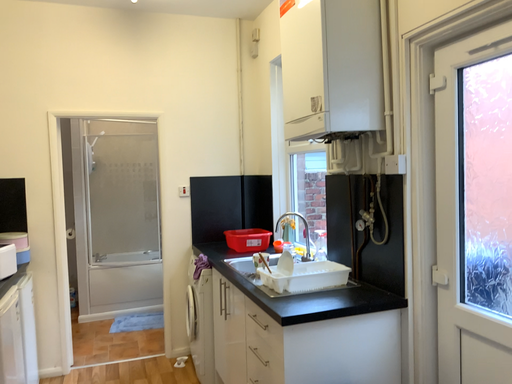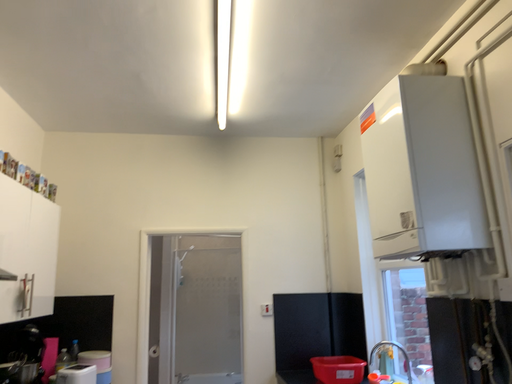
Question: Which way did the camera rotate in the video?

Choices:
 (A) rotated downward
 (B) rotated upward

Answer: (B)